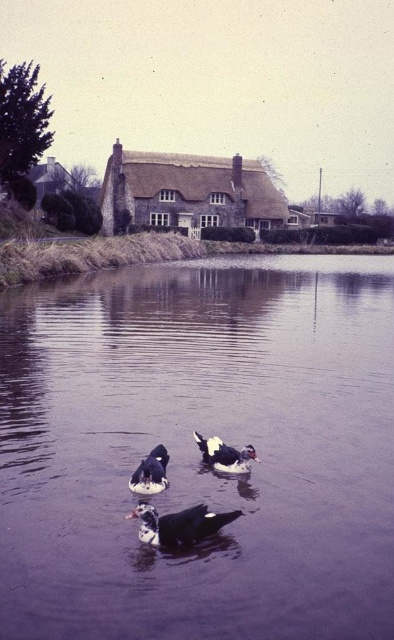
Question: Can you confirm if black glossy duck at center is thinner than white glossy duck at center?

Choices:
 (A) yes
 (B) no

Answer: (B)

Question: Which object appears farthest from the camera in this image?

Choices:
 (A) purple smooth water at center
 (B) white glossy duck at center
 (C) black glossy duck at center

Answer: (B)

Question: Is white glossy duck at center further to camera compared to black glossy duck at lower left?

Choices:
 (A) yes
 (B) no

Answer: (A)

Question: Is purple smooth water at center further to camera compared to black glossy duck at center?

Choices:
 (A) yes
 (B) no

Answer: (B)

Question: Which of these objects is positioned farthest from the white glossy duck at center?

Choices:
 (A) black glossy duck at center
 (B) black glossy duck at lower left

Answer: (A)

Question: Which of the following is the closest to the observer?

Choices:
 (A) black glossy duck at center
 (B) black glossy duck at lower left
 (C) purple smooth water at center
 (D) white glossy duck at center

Answer: (C)